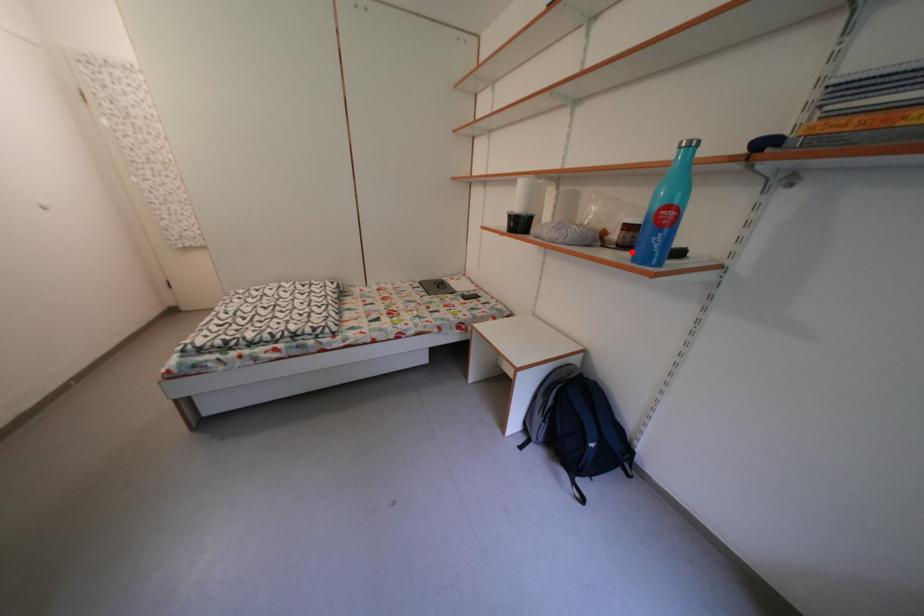
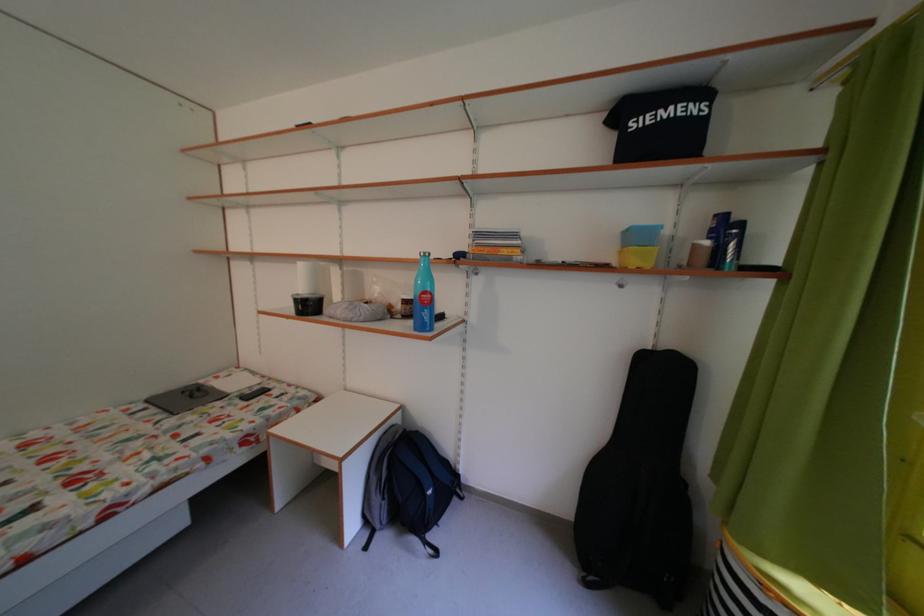
Question: I am providing you with two images of the same scene from different viewpoints. A red point is marked on the first image. Is the red point's position out of view in image 2?

Choices:
 (A) Yes
 (B) No

Answer: (B)